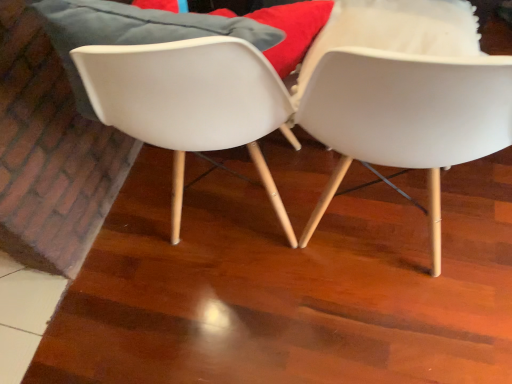
Locate an element on the screen. free point in front of white matte chair at center, positioned as the 2th chair in left-to-right order is located at coordinates (408, 331).